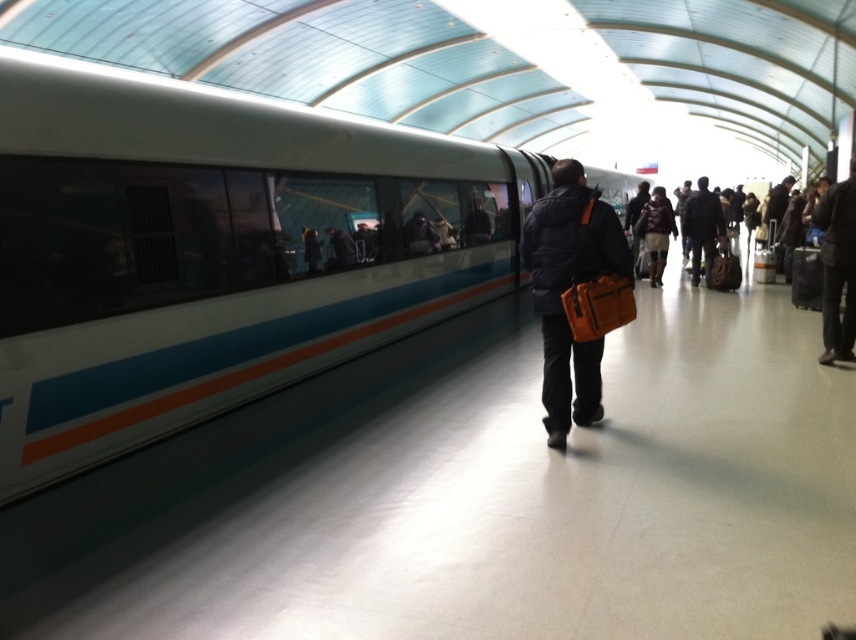
Can you confirm if white glossy train at left is positioned above dark blue jacket at center-right?

Incorrect, white glossy train at left is not positioned above dark blue jacket at center-right.

Does point (207, 138) come farther from viewer compared to point (704, 243)?

That is False.

The height and width of the screenshot is (640, 856). Describe the element at coordinates (215, 252) in the screenshot. I see `white glossy train at left` at that location.

I want to click on white glossy train at left, so (x=215, y=252).

Who is more distant from viewer, (x=547, y=227) or (x=706, y=216)?

The point (x=706, y=216) is behind.

Measure the distance between matte black jacket at center and camera.

The distance of matte black jacket at center from camera is 13.99 feet.

Between point (607, 272) and point (702, 237), which one is positioned behind?

The point (702, 237) is behind.

This screenshot has height=640, width=856. I want to click on matte black jacket at center, so click(x=569, y=288).

Who is lower down, white glossy train at left or dark brown leather jacket at center?

white glossy train at left is below.

Does white glossy train at left have a smaller size compared to dark brown leather jacket at center?

No, white glossy train at left is not smaller than dark brown leather jacket at center.

Is point (155, 205) closer to viewer compared to point (652, 228)?

Yes, it is in front of point (652, 228).

This screenshot has height=640, width=856. I want to click on white glossy train at left, so click(x=215, y=252).